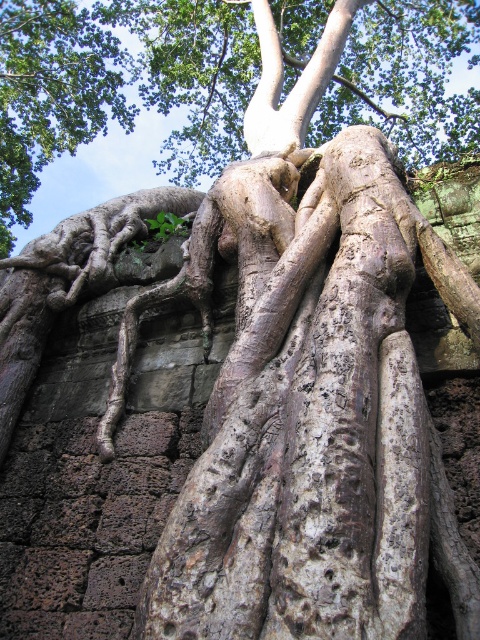
You are a botanist examining the tree roots in the image. You need to identify which of the two roots, the rough bark roots at center or the green rough bark roots at upper left, is larger in size. Based on the scene, which one should you report as larger?

The rough bark roots at center is bigger than the green rough bark roots at upper left, so you should report the rough bark roots at center as the larger one.

You are standing at a safe distance from the rough bark roots at center. If you want to touch the roots without moving closer, can you do it?

The rough bark roots at center are 20.76 meters away from the viewer. Since this distance is too far to reach, you cannot touch them without moving closer.

You are a botanist studying the tree roots in the image. You need to determine the relative positions of the roots. Which of the two roots, the rough bark roots at center or the green rough bark roots at upper left, is positioned to the right side?

The rough bark roots at center are positioned to the right of the green rough bark roots at upper left.